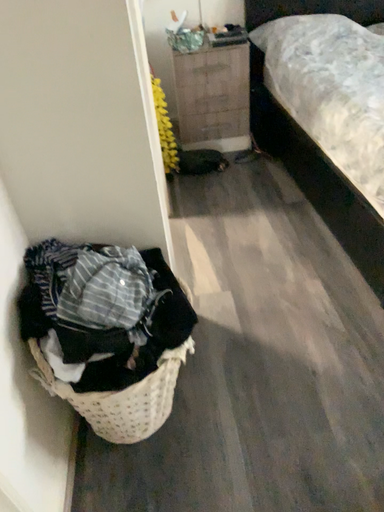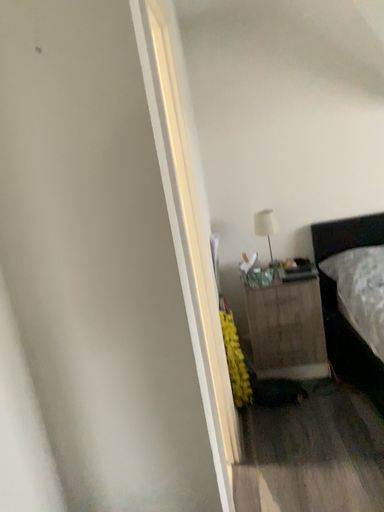
Question: Which way did the camera rotate in the video?

Choices:
 (A) rotated downward
 (B) rotated upward

Answer: (B)